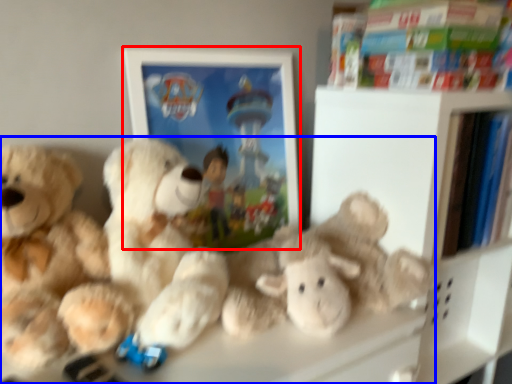
Question: Which object appears closest to the camera in this image, picture frame (highlighted by a red box) or teddy bear (highlighted by a blue box)?

Choices:
 (A) picture frame
 (B) teddy bear

Answer: (B)